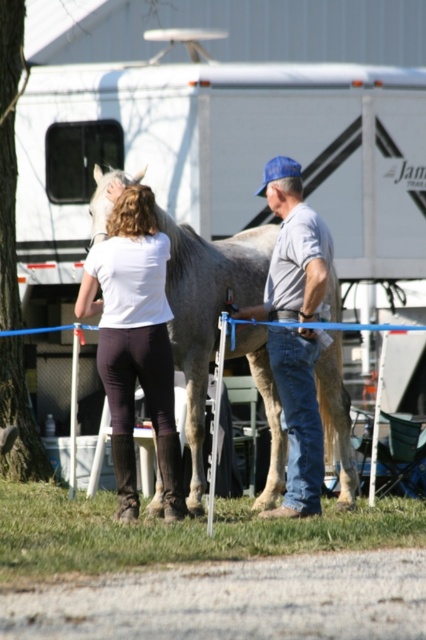
Question: Which is farther from the gray denim jeans at center?

Choices:
 (A) gray matte horse at center
 (B) matte white shirt at center
 (C) white plastic trailer at upper center

Answer: (C)

Question: Which of the following is the farthest from the observer?

Choices:
 (A) (218, 275)
 (B) (291, 243)
 (C) (204, 300)

Answer: (A)

Question: Does white plastic trailer at upper center have a lesser width compared to gray denim jeans at center?

Choices:
 (A) yes
 (B) no

Answer: (A)

Question: Which of the following is the closest to the observer?

Choices:
 (A) gray denim jeans at center
 (B) white plastic trailer at upper center

Answer: (A)

Question: Is white plastic trailer at upper center to the left of matte white shirt at center from the viewer's perspective?

Choices:
 (A) yes
 (B) no

Answer: (B)

Question: Is white plastic trailer at upper center behind gray matte horse at center?

Choices:
 (A) no
 (B) yes

Answer: (B)